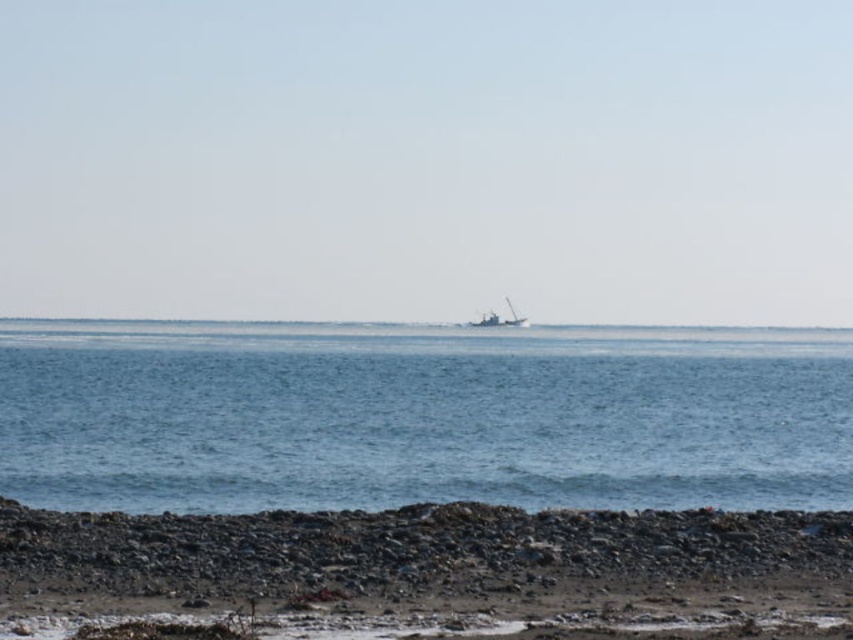
You are a photographer planning to capture the entire scene in one shot. Given that the blue water at center and the rough textured rocks at lower center are both in your frame, which object will occupy more of the visual space in your photo?

The blue water at center will occupy more visual space in the photo because it has a larger size compared to the rough textured rocks at lower center.

Based on the photo, you are standing on the rocky shoreline and want to walk to the blue water at center. Which direction should you head towards from the rough textured rocks at lower center?

You should head to the left because the blue water at center is located to the left of the rough textured rocks at lower center.

You are standing at the origin point of the coordinate system. You want to walk to the rough textured rocks at lower center. What direction should you walk? Please provide the coordinates of the direction vector as a tuple of two decimals between 0 and 1, where the first number is the x coordinate and the second is the y coordinate. For example, if the direction is to the right and down, the tuple would be something like 0.9, 0.8.

The rough textured rocks at lower center are located at coordinates (412, 550). Since you are at the origin point, the direction vector to reach them would be the same as their coordinates, so the direction vector is (409, 550).